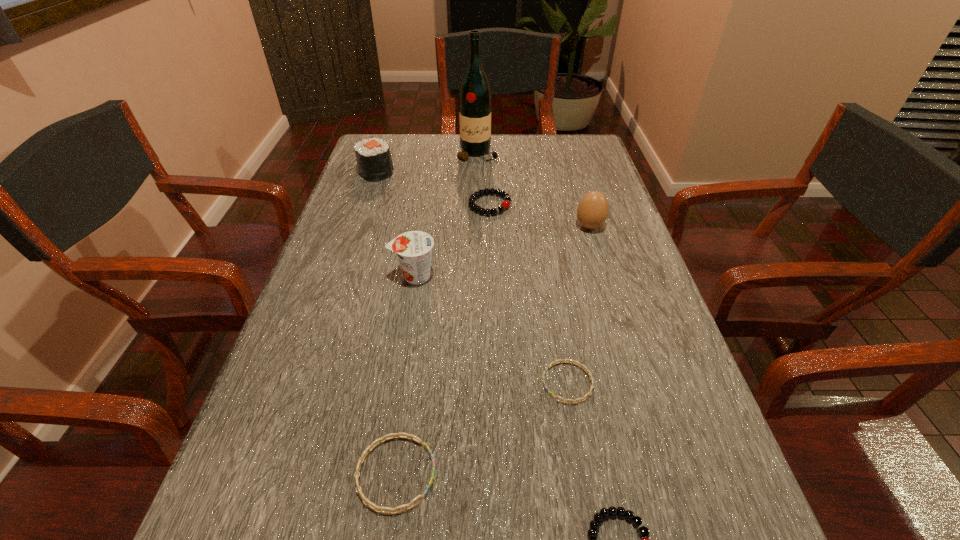
At what (x,y) coordinates should I click in order to perform the action: click on the left blue bracelet. Please return your answer as a coordinate pair (x, y). Image resolution: width=960 pixels, height=540 pixels. Looking at the image, I should click on (395, 435).

Where is `the third nearest bracelet`? Image resolution: width=960 pixels, height=540 pixels. the third nearest bracelet is located at coordinates (561, 361).

The width and height of the screenshot is (960, 540). Find the location of `the shortest bracelet`. the shortest bracelet is located at coordinates point(561,361).

Where is `free space located 0.400m on the surface of the farthest object`? free space located 0.400m on the surface of the farthest object is located at coordinates (476, 246).

Image resolution: width=960 pixels, height=540 pixels. I want to click on blank space located 0.160m on the left of the boiled egg, so click(x=512, y=226).

The width and height of the screenshot is (960, 540). Find the location of `vacant space located 0.400m on the front of the leftmost object`. vacant space located 0.400m on the front of the leftmost object is located at coordinates (341, 276).

At what (x,y) coordinates should I click in order to perform the action: click on vacant space located 0.190m on the front of the fifth farthest object. Please return your answer as a coordinate pair (x, y). The width and height of the screenshot is (960, 540). Looking at the image, I should click on (400, 361).

This screenshot has width=960, height=540. In order to click on vacant area located 0.340m on the left of the left black bracelet in this screenshot , I will do `click(343, 205)`.

I want to click on vacant space located 0.320m on the surface of the bigger blue bracelet showing star-shaped elements, so click(647, 474).

Find the location of a particular element. The width and height of the screenshot is (960, 540). vacant area situated on the surface of the shortest object showing star-shaped elements is located at coordinates (441, 383).